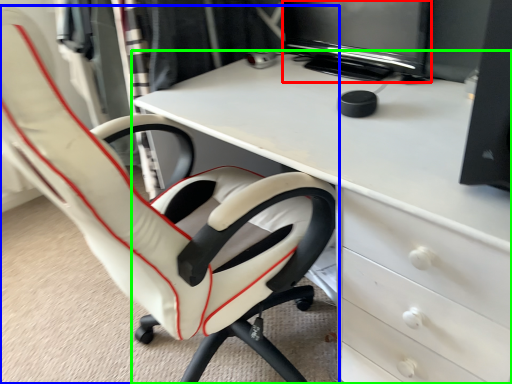
Question: Estimate the real-world distances between objects in this image. Which object is farther from computer monitor (highlighted by a red box), chair (highlighted by a blue box) or desk (highlighted by a green box)?

Choices:
 (A) chair
 (B) desk

Answer: (A)